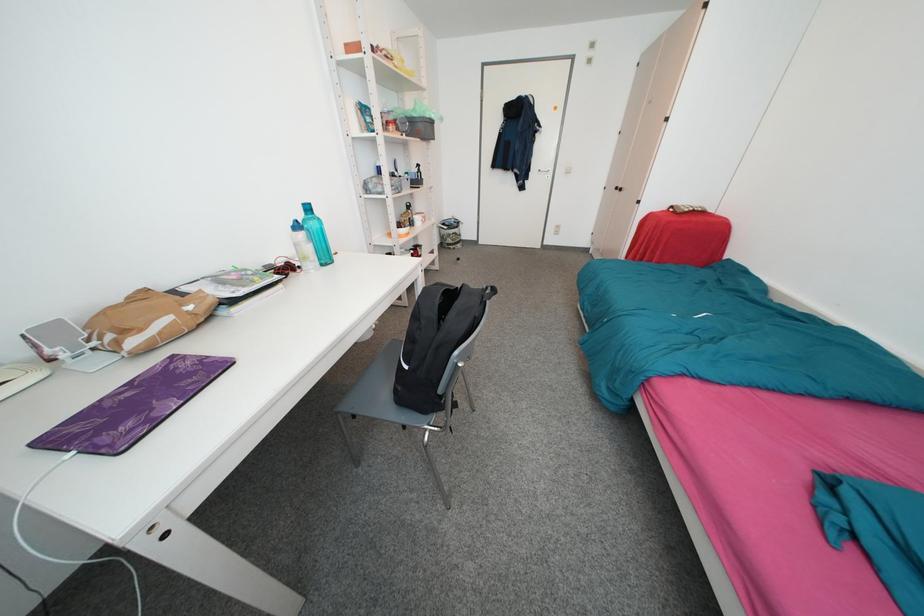
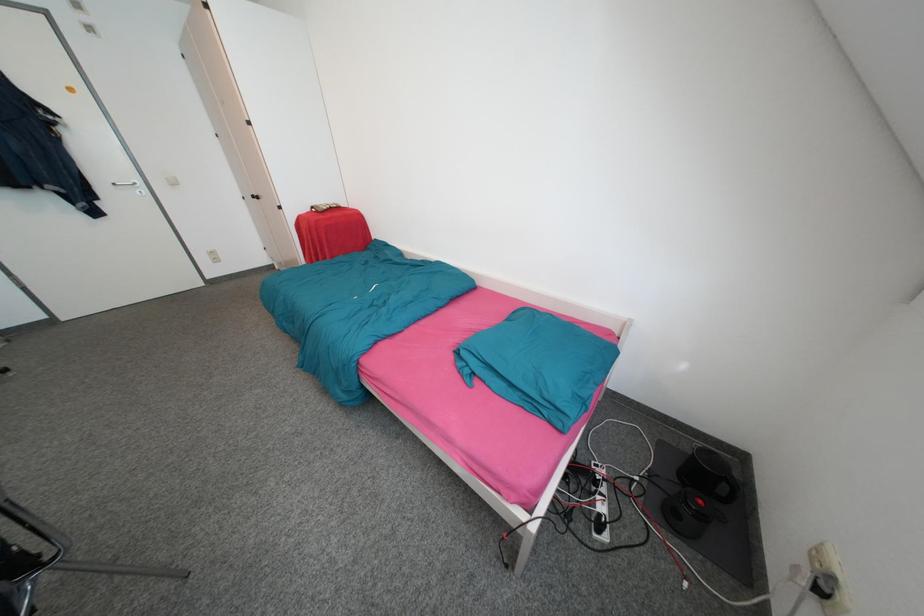
Question: Based on the continuous images, in which direction is the camera rotating? Reply with the corresponding letter.

Choices:
 (A) Left
 (B) Right
 (C) Up
 (D) Down

Answer: (B)